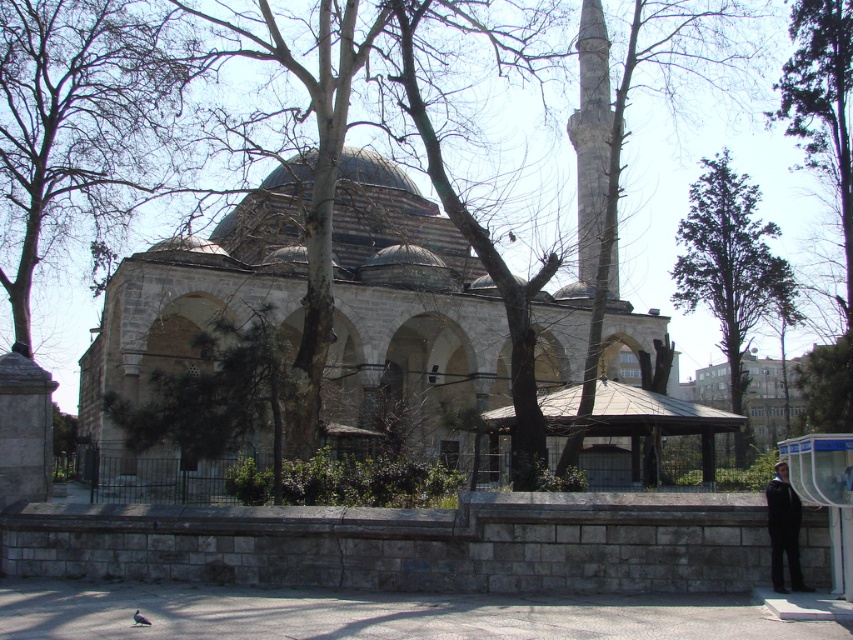
Is green leafy tree at right closer to camera compared to transparent plastic bus stop at lower right?

No, green leafy tree at right is further to the viewer.

Which is more to the left, green leafy tree at right or transparent plastic bus stop at lower right?

transparent plastic bus stop at lower right is more to the left.

Does point (759, 253) lie in front of point (848, 595)?

That is False.

The width and height of the screenshot is (853, 640). What are the coordinates of `green leafy tree at right` in the screenshot? It's located at (730, 262).

Can you confirm if green leafy tree at right is positioned to the right of brown wooden gazebo at lower right?

Indeed, green leafy tree at right is positioned on the right side of brown wooden gazebo at lower right.

Identify the location of green leafy tree at right. (730, 262).

What do you see at coordinates (637, 420) in the screenshot? The width and height of the screenshot is (853, 640). I see `brown wooden gazebo at lower right` at bounding box center [637, 420].

Is point (498, 406) positioned in front of point (788, 550)?

No.

I want to click on brown wooden gazebo at lower right, so click(637, 420).